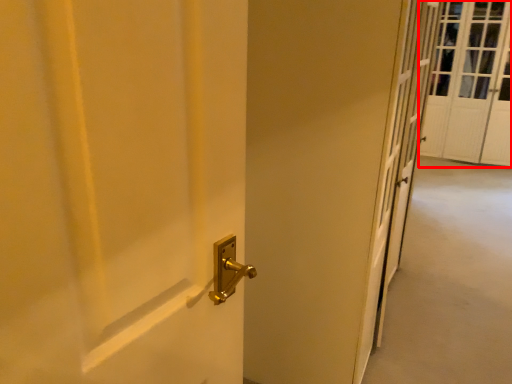
Question: In this image, where is screen door (annotated by the red box) located relative to corridor?

Choices:
 (A) right
 (B) left

Answer: (A)